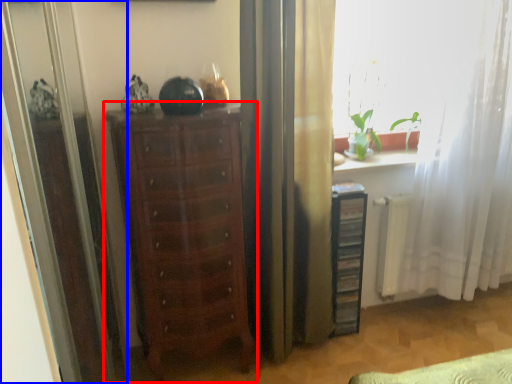
Question: Among these objects, which one is farthest to the camera, chest of drawers (highlighted by a red box) or screen door (highlighted by a blue box)?

Choices:
 (A) chest of drawers
 (B) screen door

Answer: (A)